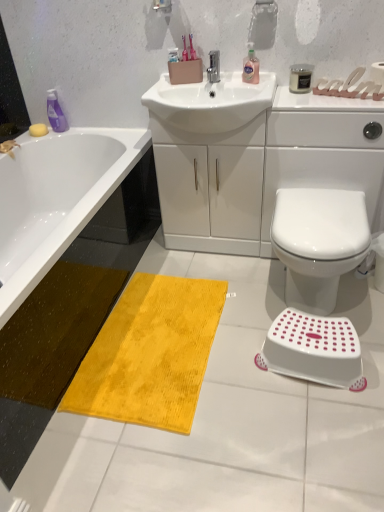
Find the location of a particular element. This screenshot has width=384, height=512. vacant point above white glossy toilet at lower right (from a real-world perspective) is located at coordinates (324, 210).